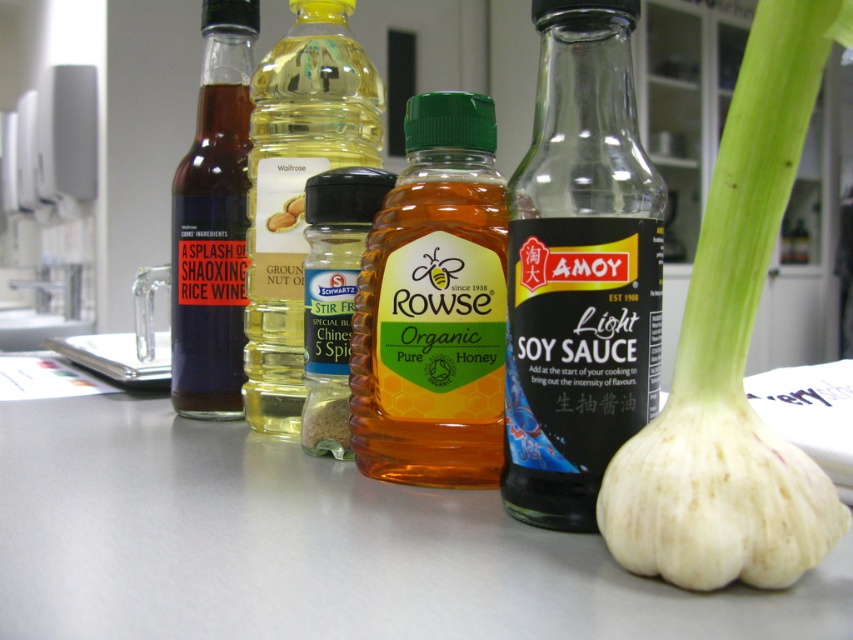
You are a chef trying to locate the Shaoxing Rice Wine for a recipe. The bottle has a point marked at coordinates (213,221). Where exactly on the bottle is this point located?

The point at coordinates (213,221) is located on the matte glass bottle of Shaoxing rice wine at left.

What are the coordinates of the golden honey jar at center?

The golden honey jar at center is located at coordinates point (434,307).